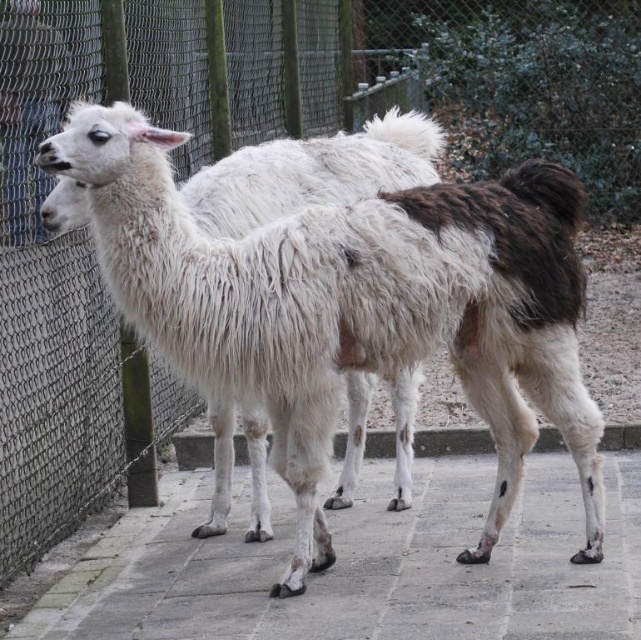
You are standing in front of the zoo enclosure looking at the white woolly alpaca at center and the gray concrete pavement at center. Which object is nearer to you?

The white woolly alpaca at center is closer to the viewer than the gray concrete pavement at center.

You are standing in front of the zoo enclosure with two alpacas. You notice two points marked in the image. The first point is at coordinate point [490,225] and the second is at point [160,557]. If you want to take a photo that includes both points clearly, which point should you focus on first to ensure both are in focus?

You should focus on point [490,225] first because it is closer to the camera than point [160,557]. By focusing on the closer point, the farther point will also be within the depth of field, ensuring both are in focus.

You are standing in front of the zoo enclosure with two alpacas. You see the white woolly alpaca at center and the gray concrete pavement at center. Which one is positioned to the left when viewed from your perspective?

The white woolly alpaca at center is to the left of the gray concrete pavement at center.